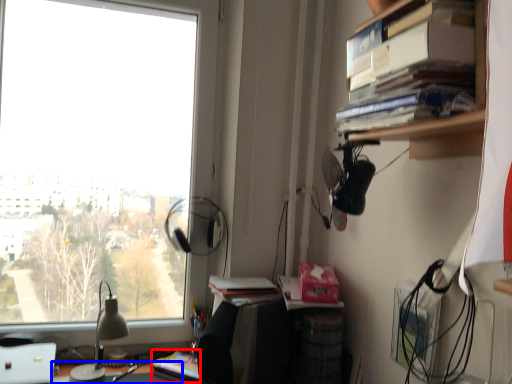
Question: Which of the following is the closest to the observer, paperback book (highlighted by a red box) or desk (highlighted by a blue box)?

Choices:
 (A) paperback book
 (B) desk

Answer: (B)